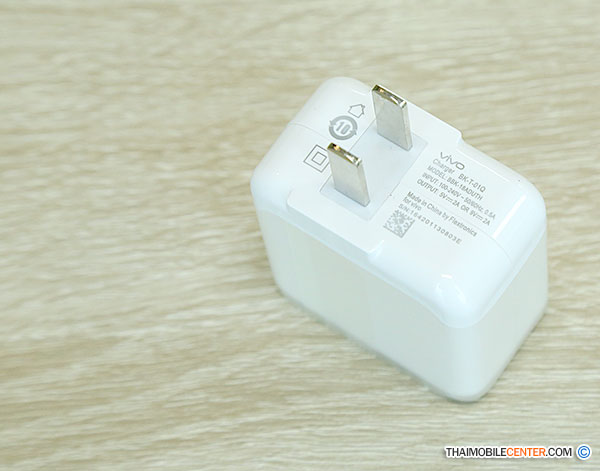
At what (x,y) coordinates should I click in order to perform the action: click on charger. Please return your answer as a coordinate pair (x, y). This screenshot has height=471, width=600. Looking at the image, I should click on (442, 164).